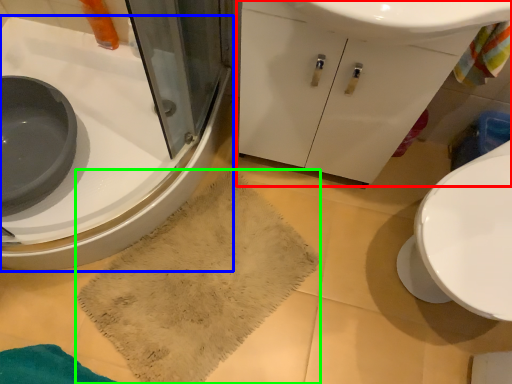
Question: Which is nearer to the bathroom cabinet (highlighted by a red box)? sink (highlighted by a blue box) or bath towel (highlighted by a green box).

Choices:
 (A) sink
 (B) bath towel

Answer: (B)